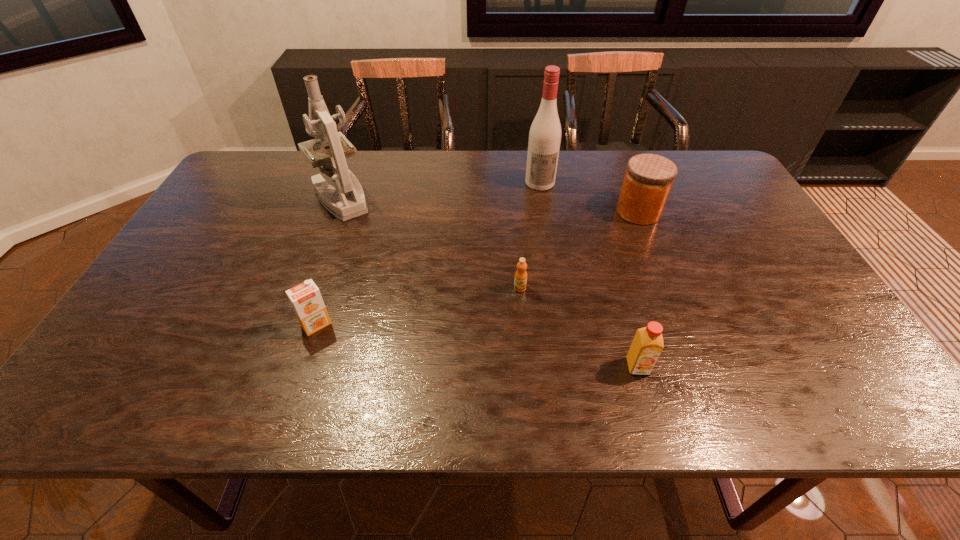
Find the location of a particular element. empty space between the farthest orange juice and the leftmost orange juice is located at coordinates coord(419,306).

You are a GUI agent. You are given a task and a screenshot of the screen. Output one action in this format:
    pyautogui.click(x=<x>, y=<y>)
    Task: Click on the vacant area between the second nearest object and the farthest orange juice
    This screenshot has width=960, height=540.
    Given the screenshot: What is the action you would take?
    pyautogui.click(x=419, y=306)

Where is `free space that is in between the microscope and the third nearest object`? The width and height of the screenshot is (960, 540). free space that is in between the microscope and the third nearest object is located at coordinates (430, 243).

I want to click on object that can be found as the second closest to the rightmost object, so click(520, 281).

Image resolution: width=960 pixels, height=540 pixels. In order to click on object that is the fifth closest to the leftmost orange juice in this screenshot , I will do `click(648, 180)`.

Where is `the third closest orange juice to the rightmost object`? This screenshot has width=960, height=540. the third closest orange juice to the rightmost object is located at coordinates (305, 298).

This screenshot has height=540, width=960. What are the coordinates of `orange juice that is the third closest to the microscope` in the screenshot? It's located at (647, 345).

The height and width of the screenshot is (540, 960). Find the location of `vacant point that satisfies the following two spatial constraints: 1. on the front side of the microscope; 2. on the right side of the second nearest object`. vacant point that satisfies the following two spatial constraints: 1. on the front side of the microscope; 2. on the right side of the second nearest object is located at coordinates (294, 325).

What are the coordinates of `vacant space that satisfies the following two spatial constraints: 1. on the label of the rightmost object; 2. on the right side of the fourth object from left to right` in the screenshot? It's located at (544, 212).

Find the location of `free location that satisfies the following two spatial constraints: 1. on the front side of the rightmost object; 2. on the left side of the microscope`. free location that satisfies the following two spatial constraints: 1. on the front side of the rightmost object; 2. on the left side of the microscope is located at coordinates 336,212.